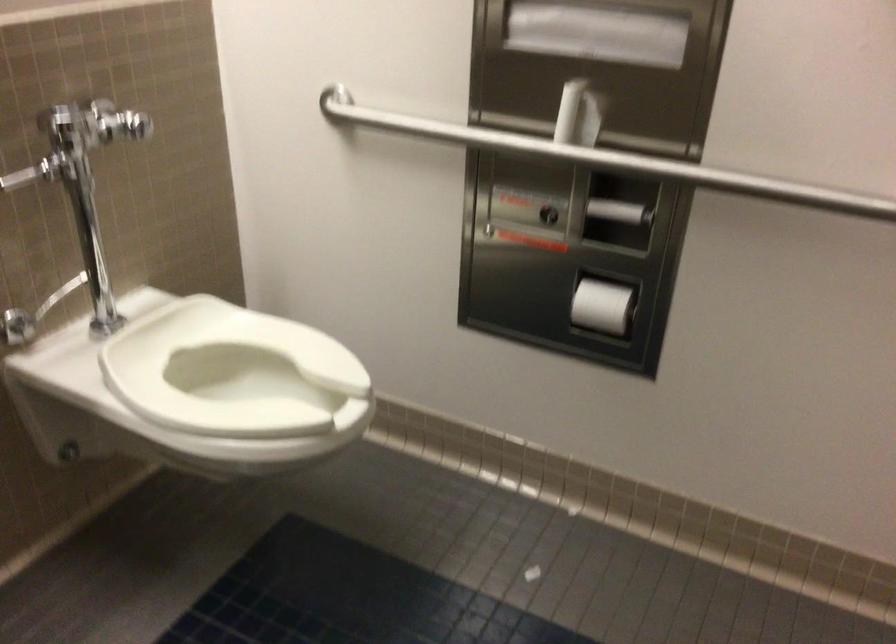
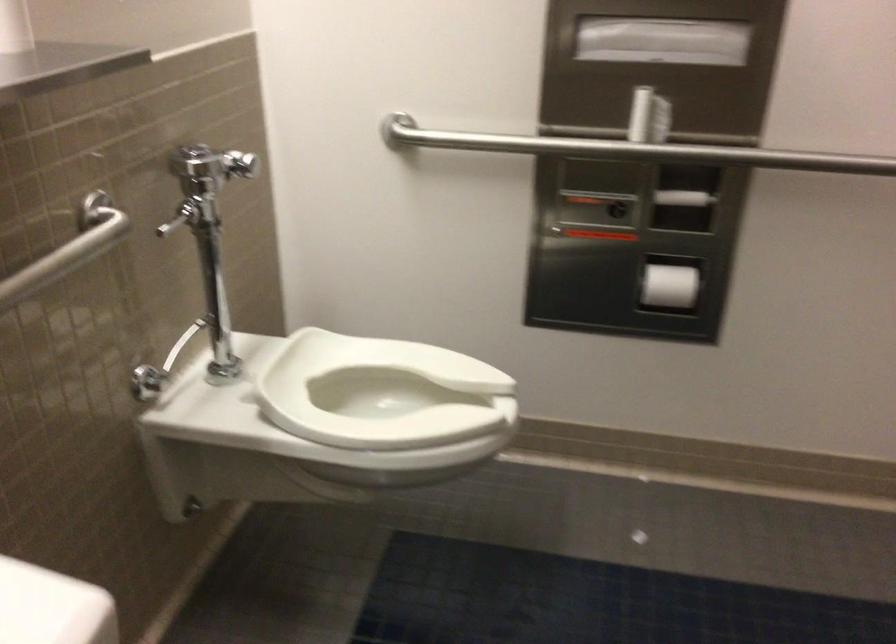
In the second image, find the point that corresponds to (616,209) in the first image.

(683, 198)